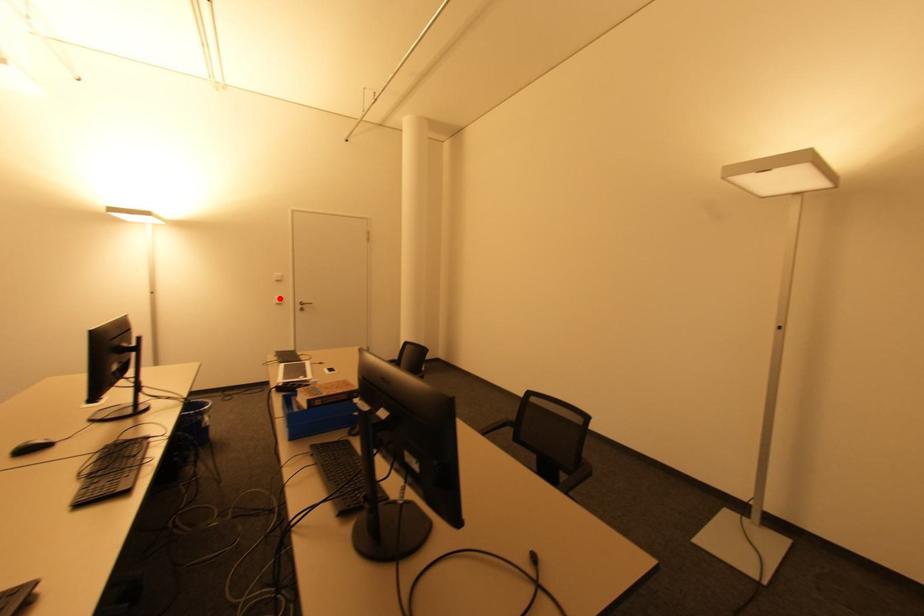
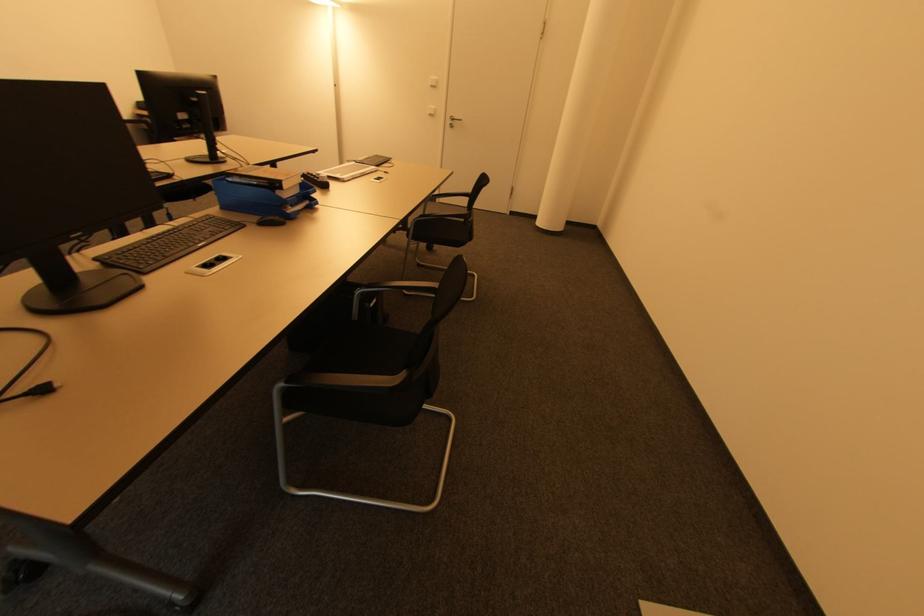
Question: I am providing you with two images of the same scene from different viewpoints. Given a red point in image1, look at the same physical point in image2. Is it:

Choices:
 (A) Closer to the viewpoint
 (B) Farther from the viewpoint

Answer: (A)